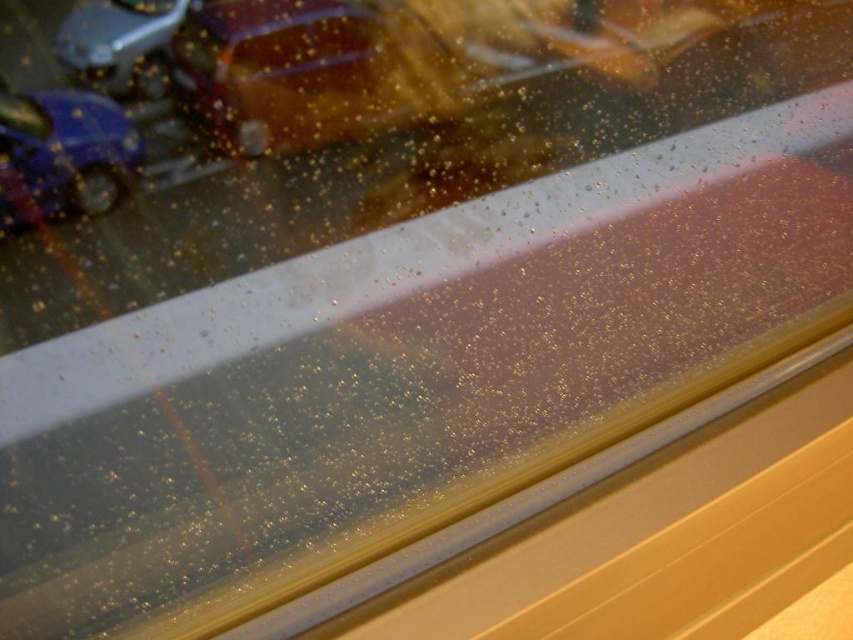
Question: Considering the relative positions of shiny blue car at left and shiny metallic car at upper left in the image provided, where is shiny blue car at left located with respect to shiny metallic car at upper left?

Choices:
 (A) right
 (B) left

Answer: (B)

Question: Does shiny blue car at left appear on the left side of shiny metallic car at upper left?

Choices:
 (A) yes
 (B) no

Answer: (A)

Question: Among these points, which one is nearest to the camera?

Choices:
 (A) [148, 28]
 (B) [48, 140]

Answer: (B)

Question: Does shiny blue car at left appear on the left side of shiny metallic car at upper left?

Choices:
 (A) yes
 (B) no

Answer: (A)

Question: Which point appears closest to the camera in this image?

Choices:
 (A) (128, 54)
 (B) (44, 144)

Answer: (B)

Question: Which point is closer to the camera?

Choices:
 (A) (82, 99)
 (B) (103, 83)

Answer: (A)